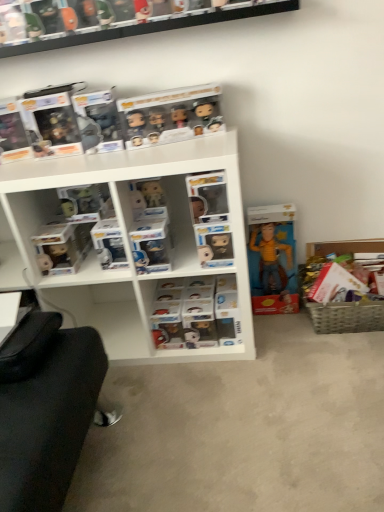
Locate an element on the screen. Image resolution: width=384 pixels, height=512 pixels. free space in front of clear plastic figures at center is located at coordinates (218, 383).